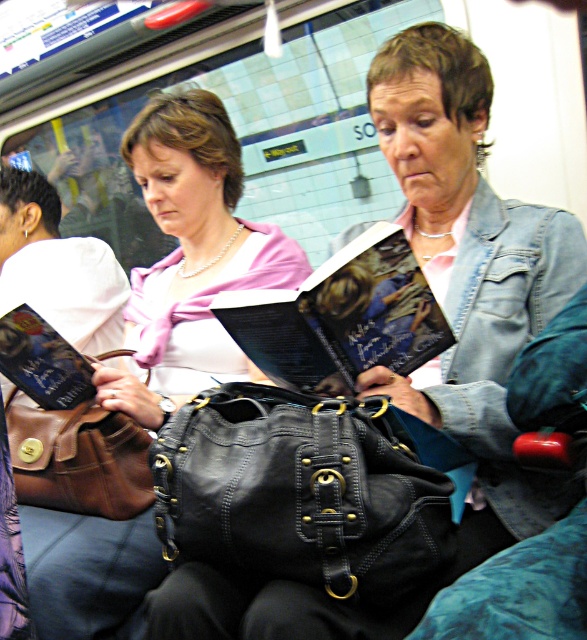
You are a person with a 12 inch wide backpack. You are standing in the subway station and want to place your backpack between the black leather bag at center and the brown leather handbag at lower left. Is there enough space between them to fit your backpack?

The distance between the black leather bag at center and the brown leather handbag at lower left is 16.85 inches. Since your backpack is 12 inches wide, there is enough space to fit it between them.

You are a passenger in the subway station and want to place your 18 cm wide backpack between the black leather bag at center and the hardcover book at center. Can you fit it there?

The black leather bag at center and hardcover book at center are 17.74 centimeters apart from each other, so the 18 cm wide backpack cannot fit between them since the distance is slightly less than the backpack width.